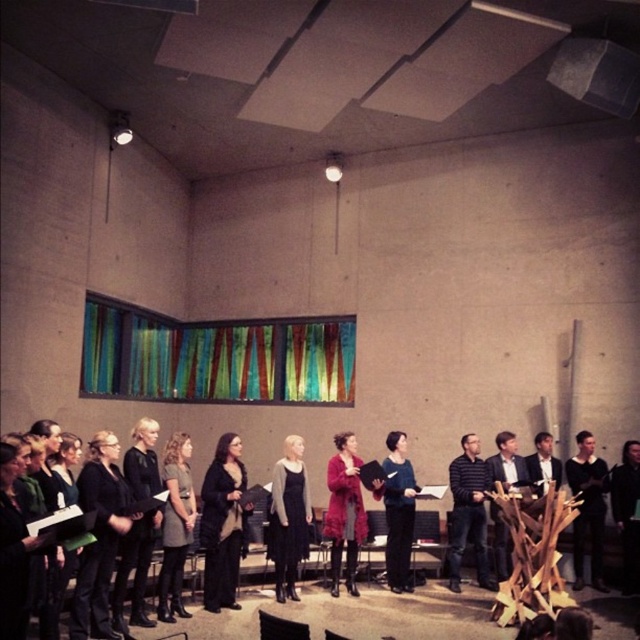
You are standing in the room and want to find the black wool sweater at center. What is its 2D coordinate location?

→ The 2D coordinate location of the black wool sweater at center is at point [221,522].

You are a photographer setting up for a group photo of the choir. You notice two members in the center wearing a black wool sweater at center and a matte pink coat at center. Which clothing item would require more space between the two members to avoid overlapping in the photo?

The matte pink coat at center is thicker than the black wool sweater at center, so it would require more space between the two members to avoid overlapping in the photo.